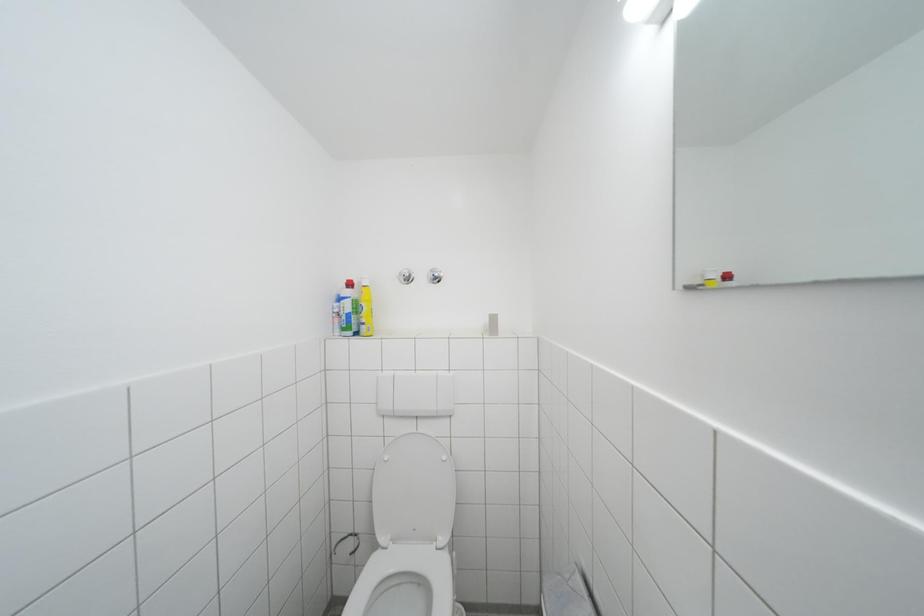
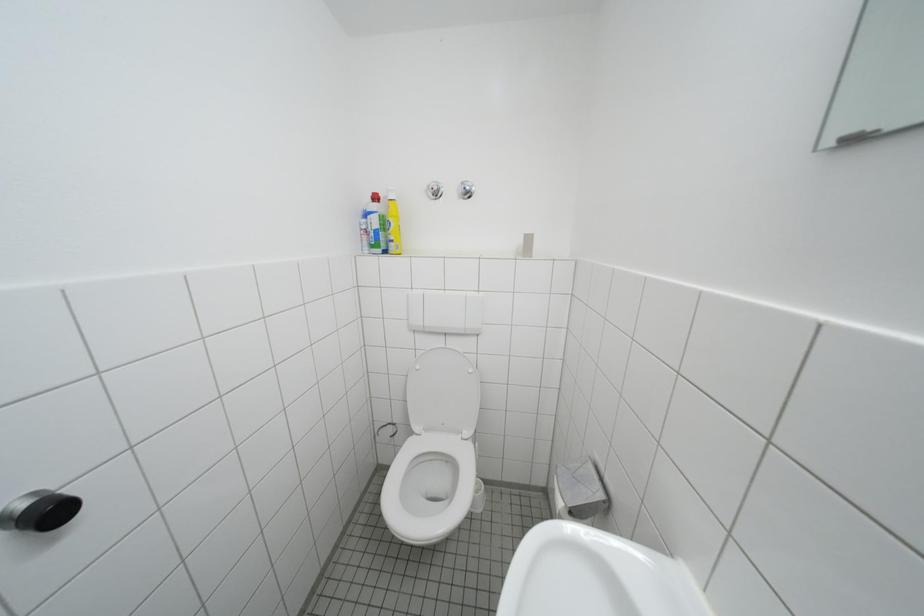
Which direction would the cameraman need to move to produce the second image?

The cameraman moved toward left, forward.